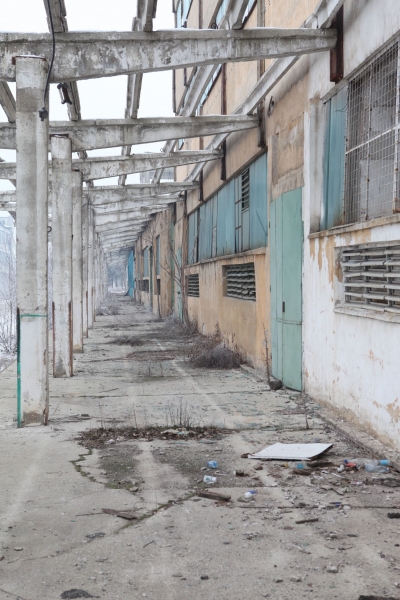
Locate an element on the screen. door is located at coordinates (300, 297), (177, 297), (151, 286).